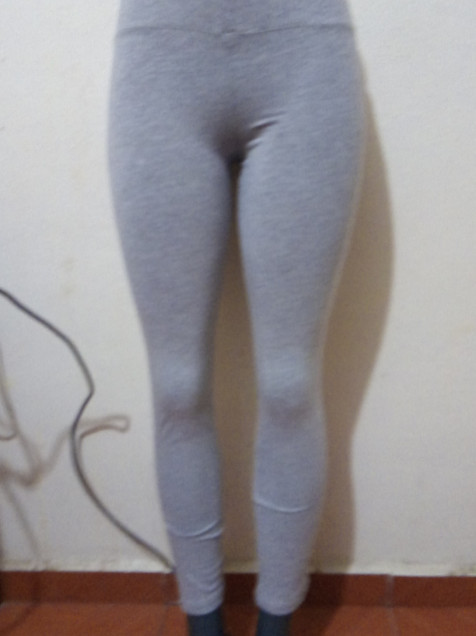
I want to click on wiring, so click(x=90, y=381).